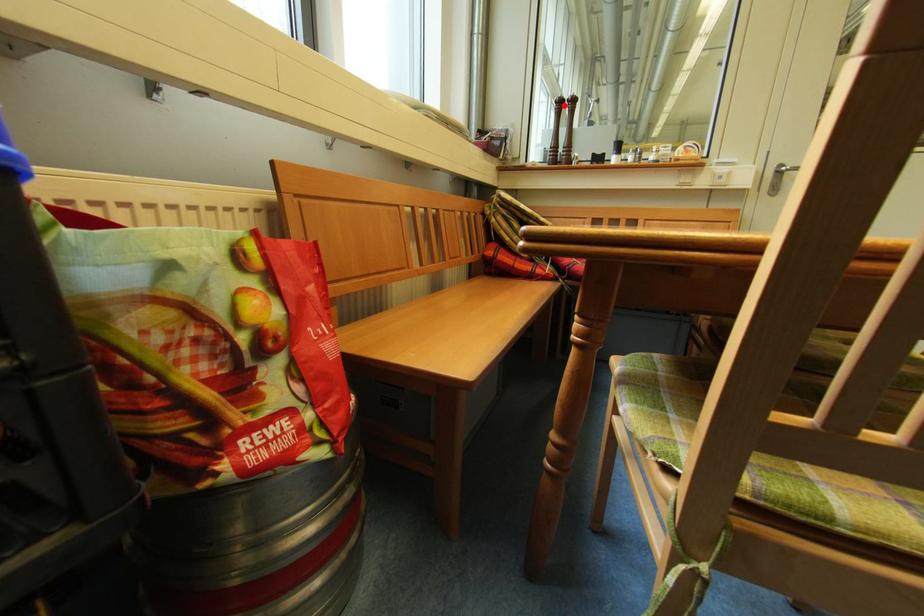
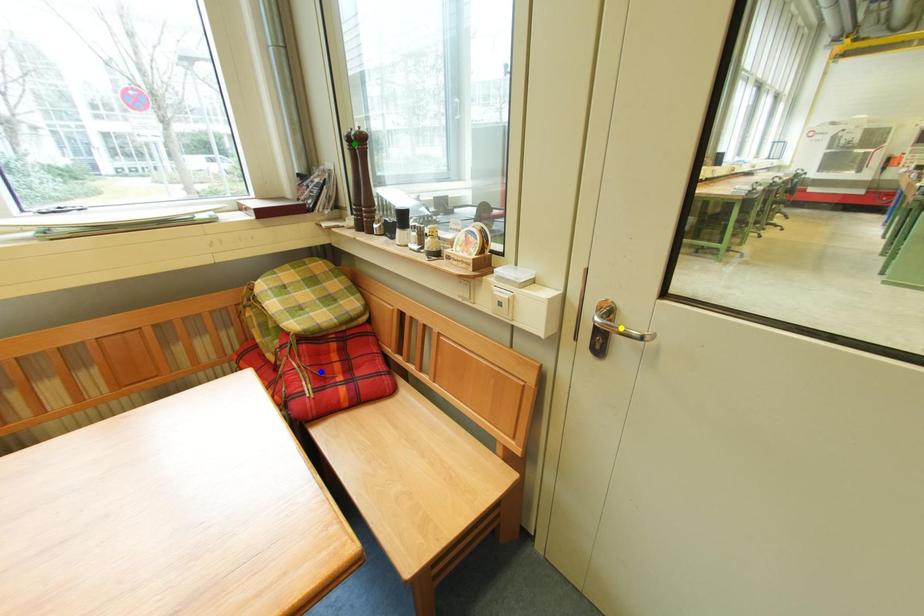
Question: I am providing you with two images of the same scene from different viewpoints. A red point is marked on the first image. You are given multiple points on the second image. Which point in image 2 is actually the same real-world point as the red point in image 1?

Choices:
 (A) yellow point
 (B) blue point
 (C) green point

Answer: (C)